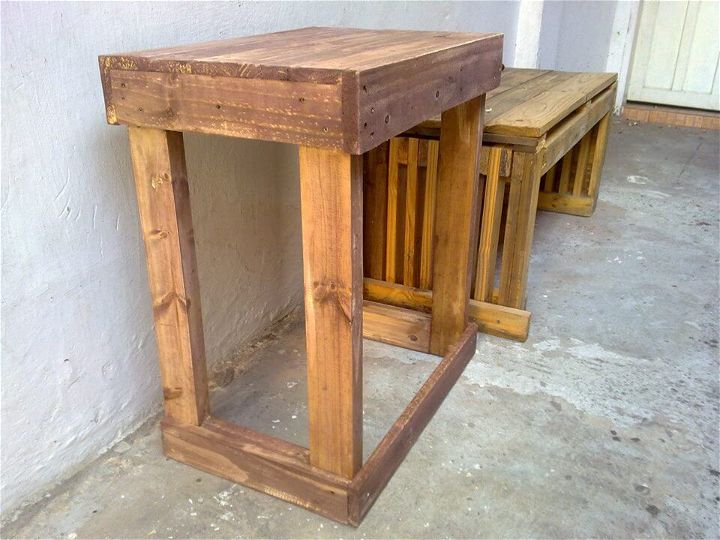
Where is `taller wood table top`? The height and width of the screenshot is (540, 720). taller wood table top is located at coordinates (279, 93).